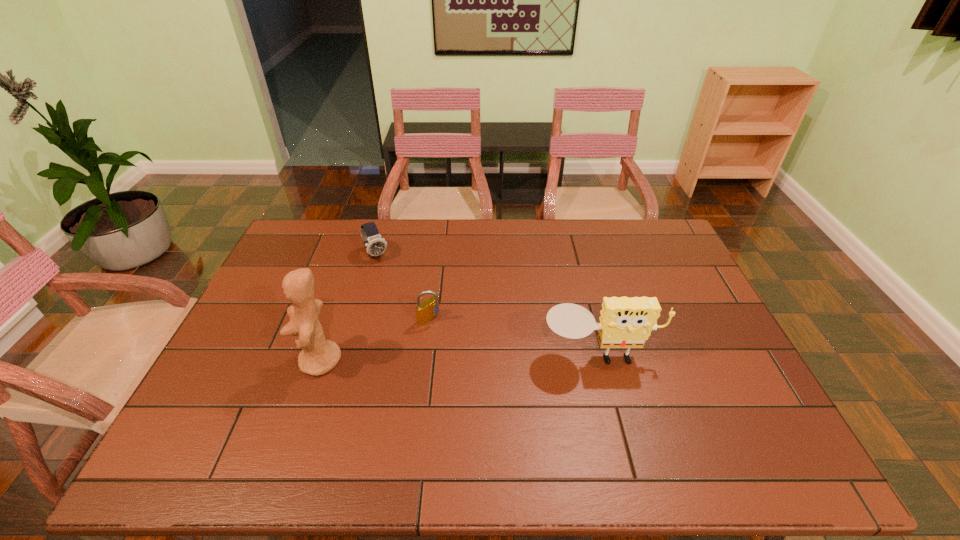
Identify the location of figurine. (319, 356).

Find the location of a particular element. The width and height of the screenshot is (960, 540). the rightmost object is located at coordinates (625, 322).

The width and height of the screenshot is (960, 540). What are the coordinates of `sponge` in the screenshot? It's located at (625, 322).

Image resolution: width=960 pixels, height=540 pixels. Find the location of `the farthest object`. the farthest object is located at coordinates (375, 245).

At what (x,y) coordinates should I click in order to perform the action: click on the second object from right to left. Please return your answer as a coordinate pair (x, y). This screenshot has width=960, height=540. Looking at the image, I should click on (426, 311).

Locate an element on the screen. padlock is located at coordinates (426, 311).

Find the location of a particular element. The width and height of the screenshot is (960, 540). free spot located 0.080m on the front-facing side of the tallest object is located at coordinates (270, 361).

This screenshot has width=960, height=540. I want to click on vacant region located on the front-facing side of the tallest object, so click(x=262, y=361).

The height and width of the screenshot is (540, 960). What are the coordinates of `free space located on the front-facing side of the tallest object` in the screenshot? It's located at (266, 361).

Identify the location of vacant region located 0.090m on the front-facing side of the second tallest object. (612, 405).